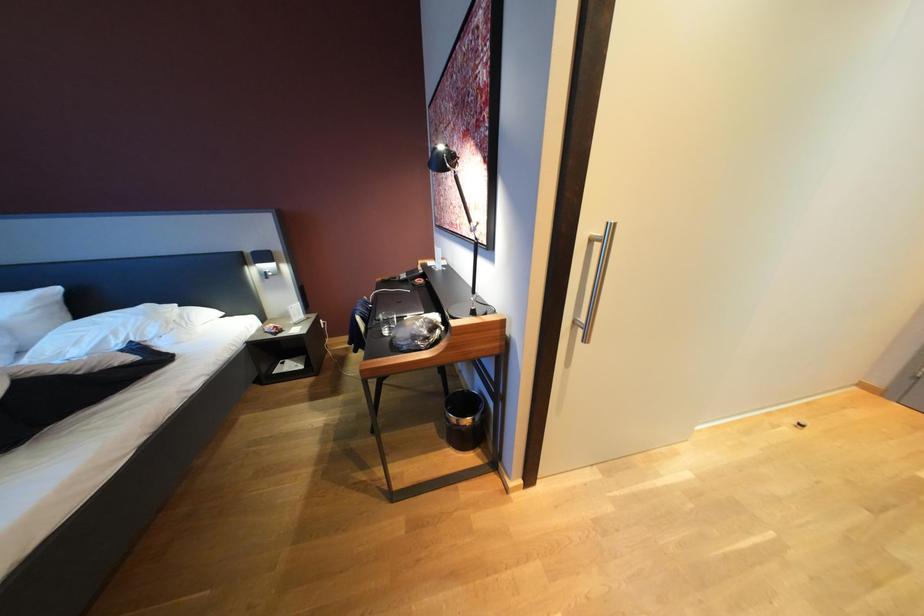
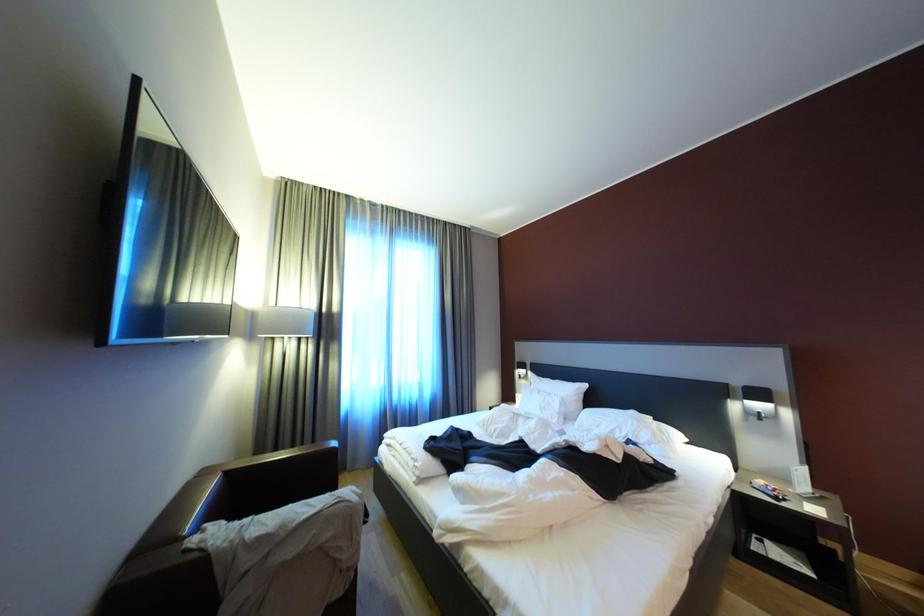
Question: Based on the continuous images, in which direction is the camera rotating? Reply with the corresponding letter.

Choices:
 (A) Left
 (B) Right
 (C) Up
 (D) Down

Answer: (A)